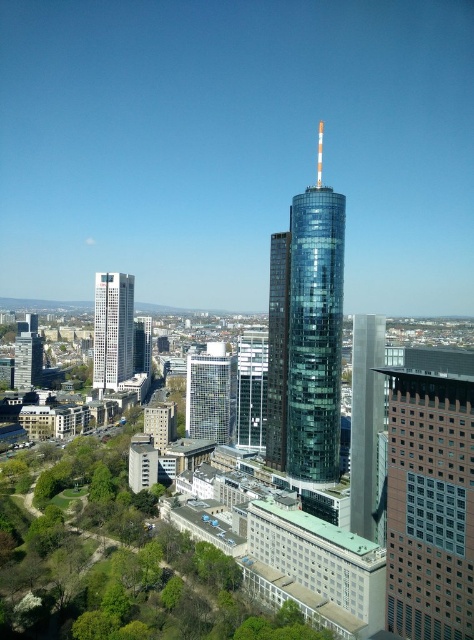
You are a drone operator trying to capture a photo of the transparent glass tower at center and the clear glass building at center. Which one should you adjust your camera angle to look up at?

The transparent glass tower at center is above the clear glass building at center, so you should adjust your camera angle to look up at the transparent glass tower at center.

You are a city planner analyzing the layout of this area. You need to determine which of the two buildings, the glassy steel skyscraper at center or the white glass tower at left, has a narrower base. Based on the aerial view provided, which one is narrower?

The glassy steel skyscraper at center has a lesser width compared to white glass tower at left, so it is narrower.